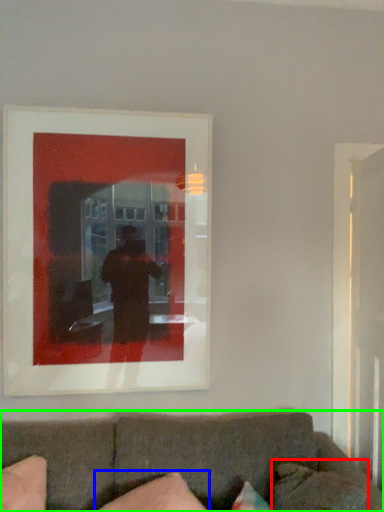
Question: Estimate the real-world distances between objects in this image. Which object is closer to pillow (highlighted by a red box), pillow (highlighted by a blue box) or studio couch (highlighted by a green box)?

Choices:
 (A) pillow
 (B) studio couch

Answer: (B)